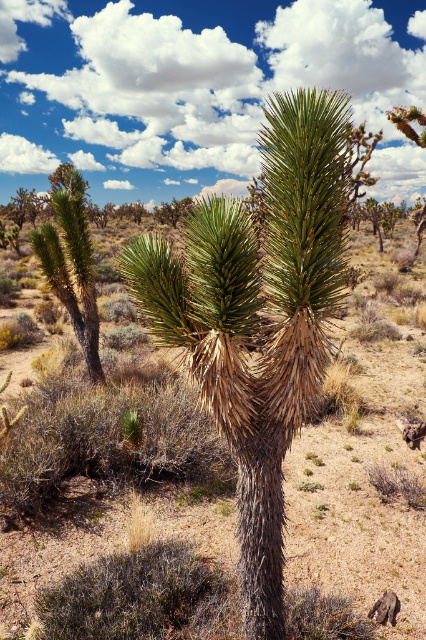
Question: Is white fluffy cloud at upper center to the right of green spiky plant at center from the viewer's perspective?

Choices:
 (A) yes
 (B) no

Answer: (B)

Question: Which point is farther from the camera taking this photo?

Choices:
 (A) (51, 232)
 (B) (393, 65)
 (C) (242, 449)

Answer: (B)

Question: Can you confirm if green spiky plant at center is thinner than green spiky plant at left?

Choices:
 (A) no
 (B) yes

Answer: (B)

Question: Is white fluffy cloud at upper center bigger than green spiky plant at left?

Choices:
 (A) no
 (B) yes

Answer: (B)

Question: Considering the real-world distances, which object is closest to the green spiky plant at center?

Choices:
 (A) white fluffy cloud at upper center
 (B) green spiky plant at left

Answer: (B)

Question: Which object is the closest to the white fluffy cloud at upper center?

Choices:
 (A) green spiky plant at left
 (B) green spiky plant at center

Answer: (A)